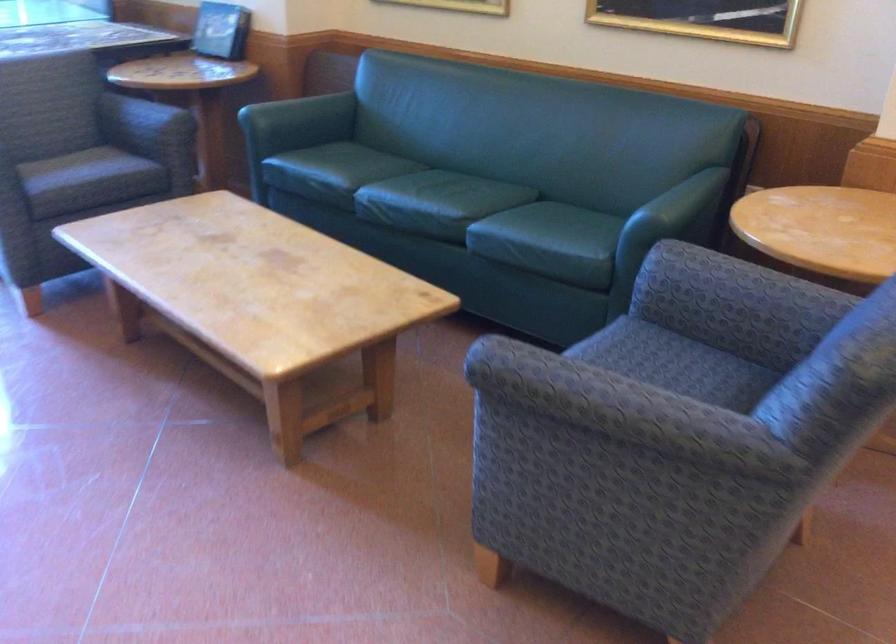
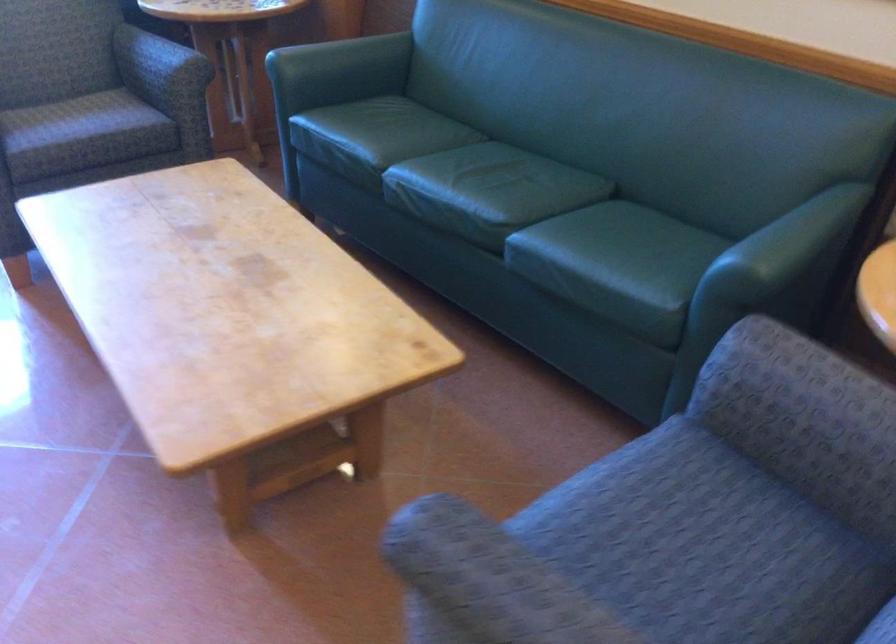
The point at (341, 167) is marked in the first image. Where is the corresponding point in the second image?

(374, 137)